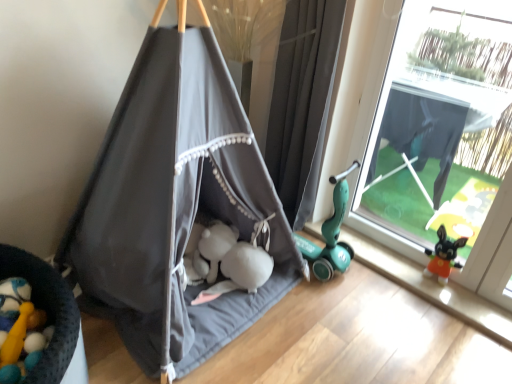
Question: From the image's perspective, is gray fabric curtain at right on transparent plastic window at right?

Choices:
 (A) no
 (B) yes

Answer: (B)

Question: Does gray fabric curtain at right have a lesser width compared to transparent plastic window at right?

Choices:
 (A) yes
 (B) no

Answer: (B)

Question: Can we say gray fabric curtain at right lies outside transparent plastic window at right?

Choices:
 (A) no
 (B) yes

Answer: (B)

Question: Is gray fabric curtain at right next to transparent plastic window at right and touching it?

Choices:
 (A) no
 (B) yes

Answer: (A)

Question: Does gray fabric curtain at right appear on the left side of transparent plastic window at right?

Choices:
 (A) no
 (B) yes

Answer: (B)

Question: Is transparent plastic window at right located within gray fabric curtain at right?

Choices:
 (A) yes
 (B) no

Answer: (B)

Question: Does dark gray fabric tent at center have a larger size compared to gray fabric curtain at right?

Choices:
 (A) no
 (B) yes

Answer: (B)

Question: Can you confirm if dark gray fabric tent at center is positioned to the right of gray fabric curtain at right?

Choices:
 (A) yes
 (B) no

Answer: (B)

Question: From a real-world perspective, is dark gray fabric tent at center beneath gray fabric curtain at right?

Choices:
 (A) no
 (B) yes

Answer: (A)

Question: Does dark gray fabric tent at center turn towards gray fabric curtain at right?

Choices:
 (A) no
 (B) yes

Answer: (A)

Question: From the image's perspective, is dark gray fabric tent at center over gray fabric curtain at right?

Choices:
 (A) yes
 (B) no

Answer: (B)

Question: Is dark gray fabric tent at center far from gray fabric curtain at right?

Choices:
 (A) no
 (B) yes

Answer: (A)

Question: Is gray fabric curtain at right closer to the viewer compared to dark gray fabric tent at center?

Choices:
 (A) no
 (B) yes

Answer: (A)